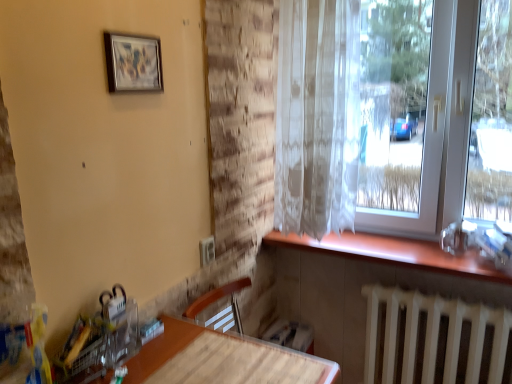
Question: Is translucent white curtain at upper right far away from matte wood table at lower left?

Choices:
 (A) no
 (B) yes

Answer: (A)

Question: Can you confirm if translucent white curtain at upper right is taller than matte wood table at lower left?

Choices:
 (A) yes
 (B) no

Answer: (B)

Question: From a real-world perspective, does translucent white curtain at upper right sit lower than matte wood table at lower left?

Choices:
 (A) no
 (B) yes

Answer: (A)

Question: Is translucent white curtain at upper right to the right of matte wood table at lower left from the viewer's perspective?

Choices:
 (A) no
 (B) yes

Answer: (B)

Question: Considering the relative sizes of translucent white curtain at upper right and matte wood table at lower left in the image provided, is translucent white curtain at upper right wider than matte wood table at lower left?

Choices:
 (A) no
 (B) yes

Answer: (B)

Question: Choose the correct answer: Is matte wood table at lower left inside wooden table at lower center or outside it?

Choices:
 (A) outside
 (B) inside

Answer: (A)

Question: Looking at their shapes, would you say matte wood table at lower left is wider or thinner than wooden table at lower center?

Choices:
 (A) thin
 (B) wide

Answer: (A)

Question: Is point click(102, 18) positioned closer to the camera than point click(278, 347)?

Choices:
 (A) closer
 (B) farther

Answer: (A)

Question: From the image's perspective, is matte wood table at lower left positioned above or below wooden table at lower center?

Choices:
 (A) below
 (B) above

Answer: (B)

Question: Is wooden table at lower center to the left or to the right of white translucent curtain at right in the image?

Choices:
 (A) right
 (B) left

Answer: (B)

Question: Considering their positions, is wooden table at lower center located in front of or behind white translucent curtain at right?

Choices:
 (A) behind
 (B) front

Answer: (B)

Question: In terms of width, does wooden table at lower center look wider or thinner when compared to white translucent curtain at right?

Choices:
 (A) thin
 (B) wide

Answer: (B)

Question: From a real-world perspective, is wooden table at lower center physically located above or below white translucent curtain at right?

Choices:
 (A) above
 (B) below

Answer: (B)

Question: Based on their positions, is white translucent curtain at right located to the left or right of translucent white curtain at upper right?

Choices:
 (A) left
 (B) right

Answer: (B)

Question: Is white translucent curtain at right wider or thinner than translucent white curtain at upper right?

Choices:
 (A) wide
 (B) thin

Answer: (A)